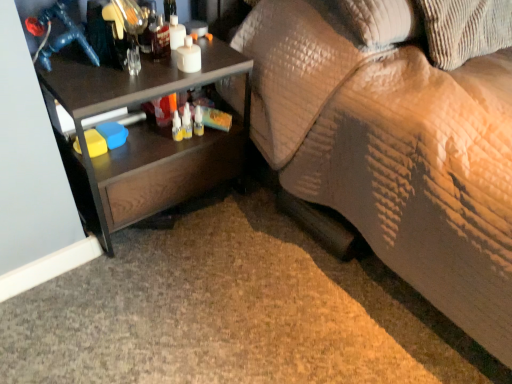
Where is `vacant area that is situated to the right of dark wood desk at left`? vacant area that is situated to the right of dark wood desk at left is located at coordinates (257, 241).